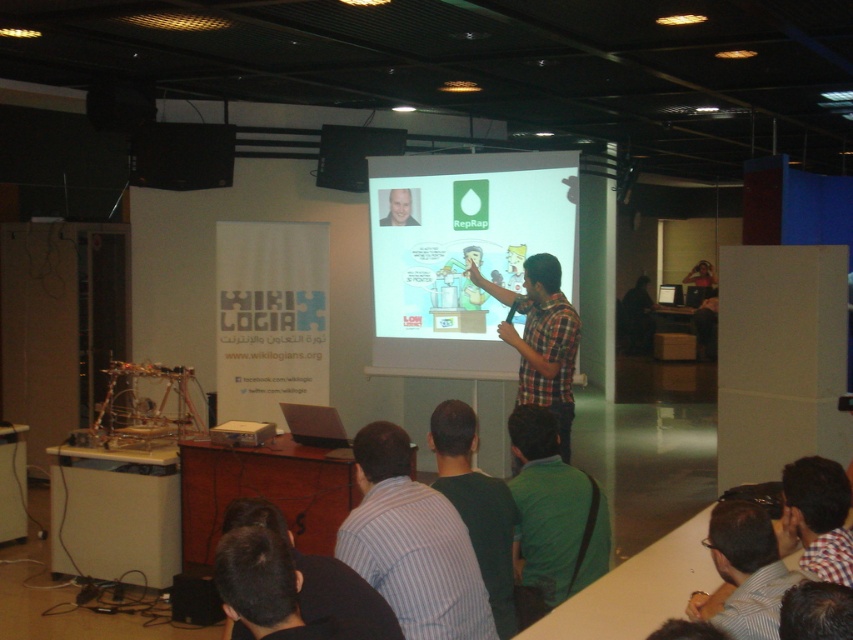
Does dark green shirt at center appear on the left side of dark brown hair at lower center?

Incorrect, dark green shirt at center is not on the left side of dark brown hair at lower center.

Is point (494, 593) positioned behind point (289, 637)?

Yes.

Identify the location of dark green shirt at center. (476, 506).

Does green fabric shirt at lower center have a larger size compared to dark green shirt at center?

Correct, green fabric shirt at lower center is larger in size than dark green shirt at center.

Does green fabric shirt at lower center come behind dark green shirt at center?

Yes, green fabric shirt at lower center is behind dark green shirt at center.

The width and height of the screenshot is (853, 640). In order to click on green fabric shirt at lower center in this screenshot , I will do `click(552, 516)`.

Can you confirm if dark brown hair at lower center is positioned to the left of matte black laptop at upper left?

Incorrect, dark brown hair at lower center is not on the left side of matte black laptop at upper left.

Is dark brown hair at lower center bigger than matte black laptop at upper left?

Actually, dark brown hair at lower center might be smaller than matte black laptop at upper left.

Where is `dark brown hair at lower center`? dark brown hair at lower center is located at coordinates (264, 586).